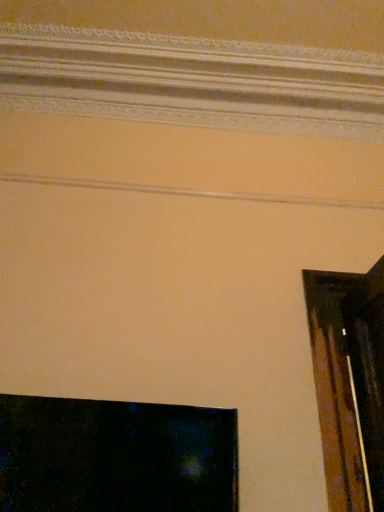
I want to click on black glossy television at lower left, so click(x=116, y=456).

Measure the distance between black glossy television at lower left and camera.

4.66 feet.

What do you see at coordinates (116, 456) in the screenshot? The image size is (384, 512). I see `black glossy television at lower left` at bounding box center [116, 456].

The image size is (384, 512). I want to click on black glossy television at lower left, so click(116, 456).